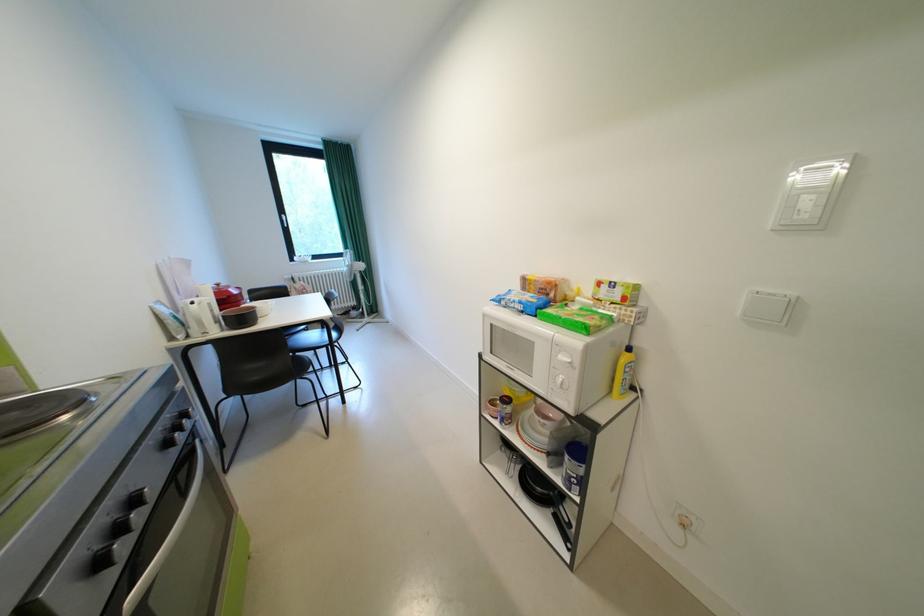
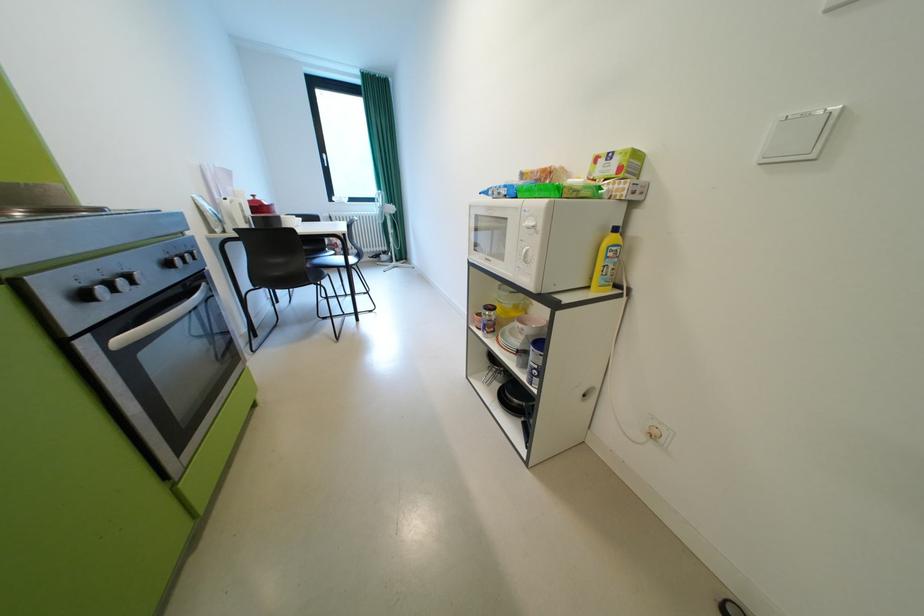
Question: The camera is either moving clockwise (left) or counter-clockwise (right) around the object. The first image is from the beginning of the video and the second image is from the end. Is the camera moving left or right when shooting the video?

Choices:
 (A) Left
 (B) Right

Answer: (B)